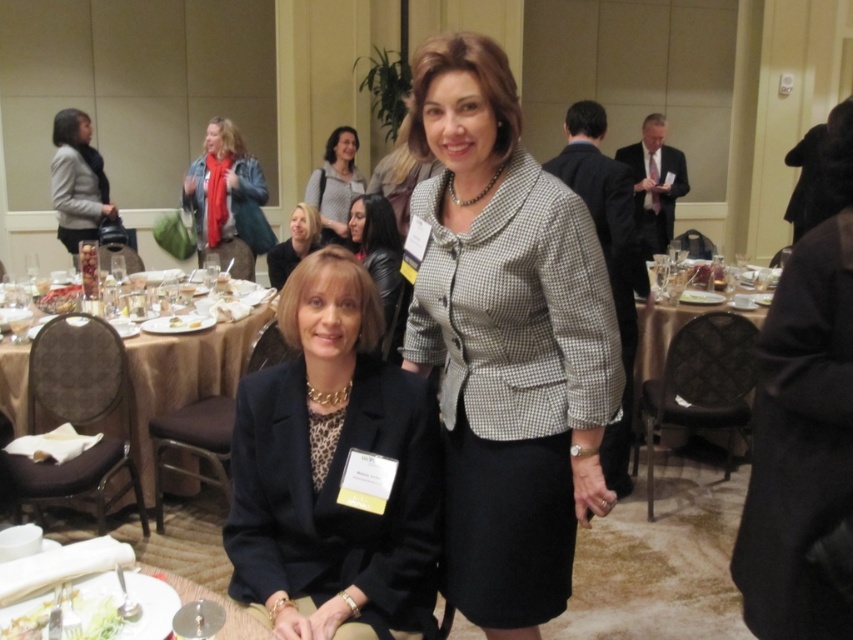
The image size is (853, 640). Identify the location of red scarf at upper left. (223, 196).

Can you confirm if red scarf at upper left is positioned to the right of matte black hair at upper center?

No, red scarf at upper left is not to the right of matte black hair at upper center.

Which is behind, point (227, 177) or point (283, 275)?

The point (227, 177) is more distant.

I want to click on red scarf at upper left, so click(x=223, y=196).

Which of these two, gold textured table at center or translucent glass plate at lower left, stands shorter?

With less height is translucent glass plate at lower left.

Does gold textured table at center appear under translucent glass plate at lower left?

Actually, gold textured table at center is above translucent glass plate at lower left.

Measure the distance between point (712, 394) and camera.

Point (712, 394) and camera are 2.97 meters apart.

What are the coordinates of `gold textured table at center` in the screenshot? It's located at (701, 385).

Who is more forward, (x=480, y=468) or (x=100, y=608)?

Point (x=100, y=608) is more forward.

Can you confirm if checkered fabric blazer at center is taller than translucent glass plate at lower left?

Indeed, checkered fabric blazer at center has a greater height compared to translucent glass plate at lower left.

At what (x,y) coordinates should I click in order to perform the action: click on checkered fabric blazer at center. Please return your answer as a coordinate pair (x, y). Looking at the image, I should click on (508, 342).